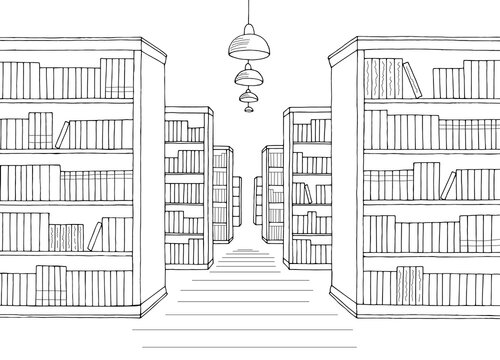
Locate an element on the screen. The height and width of the screenshot is (360, 500). top piece of leftmost bookshelves is located at coordinates tap(66, 42), tap(176, 108), tap(218, 145), tap(235, 177).